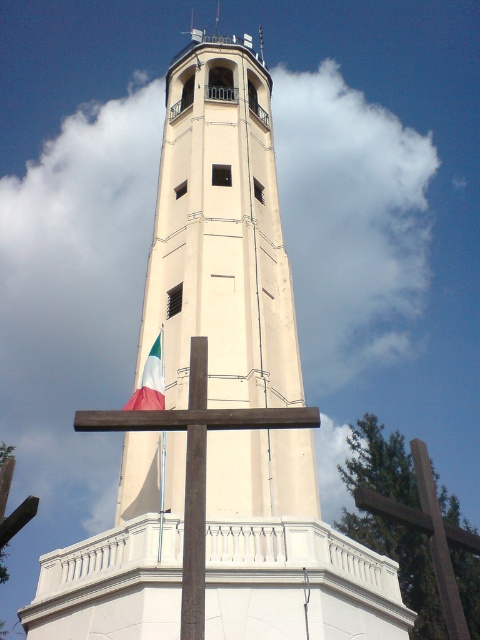
Question: Where is brown wooden cross at center located in relation to white fabric flag at center in the image?

Choices:
 (A) right
 (B) left

Answer: (B)

Question: Which of the following is the farthest from the observer?

Choices:
 (A) (155, 404)
 (B) (194, 488)

Answer: (A)

Question: Does brown wooden cross at center have a greater width compared to white fabric flag at center?

Choices:
 (A) no
 (B) yes

Answer: (B)

Question: Is brown wooden cross at center smaller than white fabric flag at center?

Choices:
 (A) yes
 (B) no

Answer: (B)